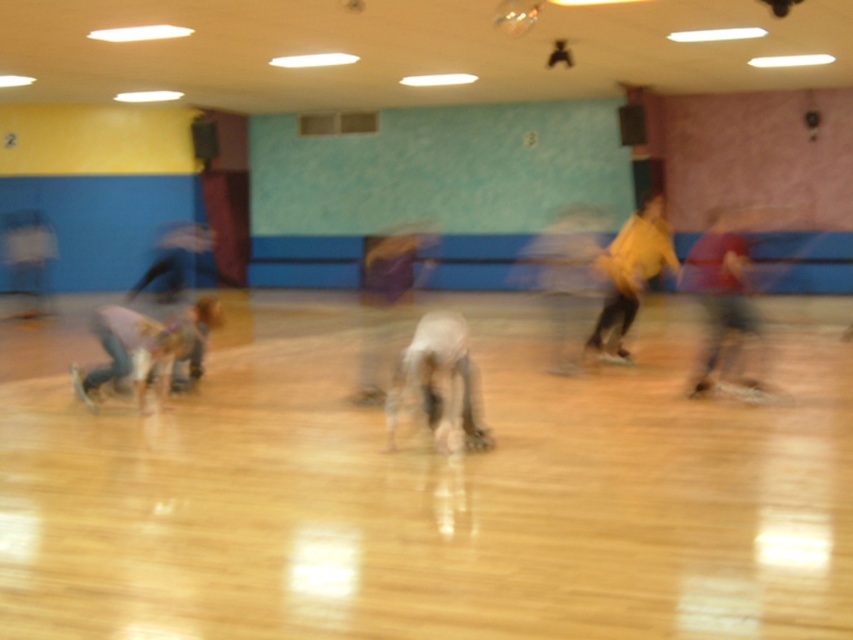
Can you confirm if yellow matte shirt at right is bigger than white matte skate at lower right?

Correct, yellow matte shirt at right is larger in size than white matte skate at lower right.

Where is `yellow matte shirt at right`? yellow matte shirt at right is located at coordinates (631, 272).

In order to click on light blue jeans at lower left in this screenshot , I will do `click(144, 346)`.

Can you confirm if light blue jeans at lower left is positioned to the left of white matte skate at lower right?

Indeed, light blue jeans at lower left is positioned on the left side of white matte skate at lower right.

What do you see at coordinates (144, 346) in the screenshot?
I see `light blue jeans at lower left` at bounding box center [144, 346].

What are the coordinates of `light blue jeans at lower left` in the screenshot? It's located at (144, 346).

Looking at this image, does light blue jeans at lower left have a larger size compared to yellow matte shirt at right?

Incorrect, light blue jeans at lower left is not larger than yellow matte shirt at right.

Between point (155, 324) and point (624, 316), which one is positioned behind?

Positioned behind is point (624, 316).

The height and width of the screenshot is (640, 853). In order to click on light blue jeans at lower left in this screenshot , I will do `click(144, 346)`.